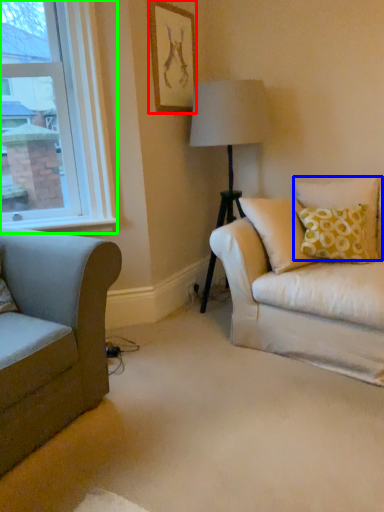
Question: Which object is positioned closest to picture frame (highlighted by a red box)? Select from pillow (highlighted by a blue box) and window (highlighted by a green box).

Choices:
 (A) pillow
 (B) window

Answer: (B)